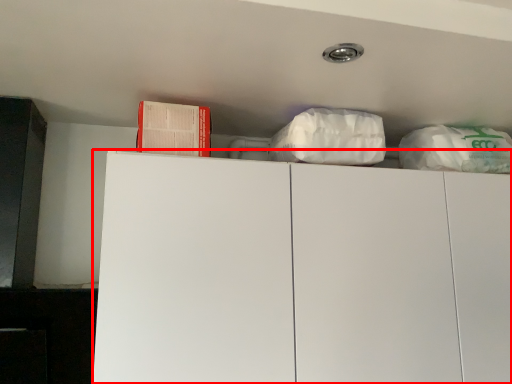
Question: From the image's perspective, where is cabinetry (annotated by the red box) located relative to book?

Choices:
 (A) below
 (B) above

Answer: (A)